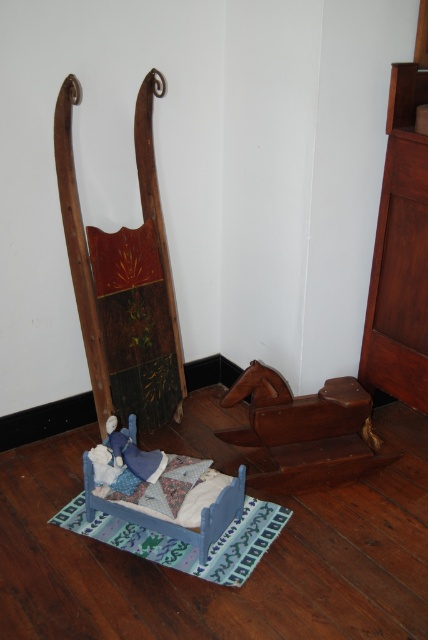
You are arranging a nursery and want to place the wooden rocking horse at lower right and the quilted fabric pillow at center in a way that follows the existing decor. Which object should be placed to the left of the other?

The wooden rocking horse at lower right should be placed to the right of the quilted fabric pillow at center since the wooden rocking horse at lower right is positioned on the right side of quilted fabric pillow at center.

Consider the image. You are organizing a room and need to place a new shelf between the mahogany wood dresser at right and the blue painted wood bed at lower center. Which object should you place the shelf closer to if you want the shelf to align with the thinner side of the objects?

The mahogany wood dresser at right is thinner than the blue painted wood bed at lower center, so you should place the shelf closer to the mahogany wood dresser at right to align with the thinner side.